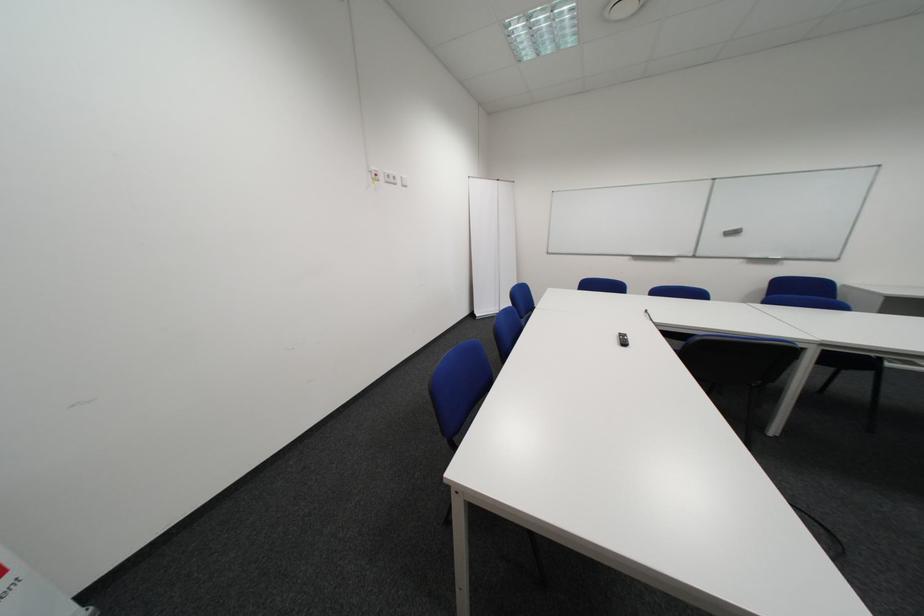
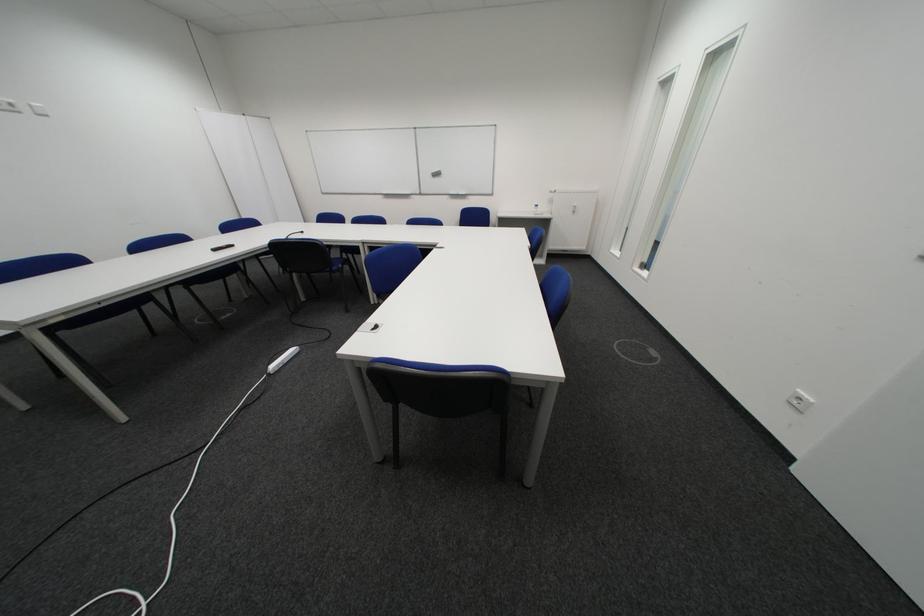
The point at (728, 228) is marked in the first image. Where is the corresponding point in the second image?

(440, 171)